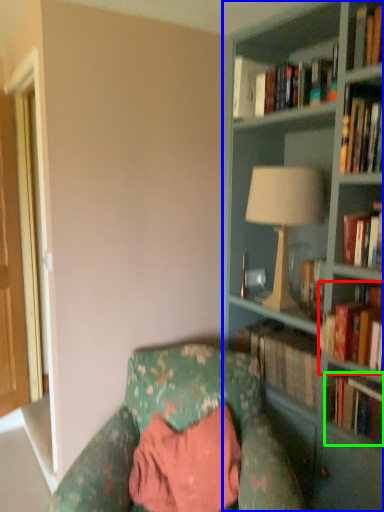
Question: Estimate the real-world distances between objects in this image. Which object is farther from book (highlighted by a red box), bookcase (highlighted by a blue box) or book (highlighted by a green box)?

Choices:
 (A) bookcase
 (B) book

Answer: (A)